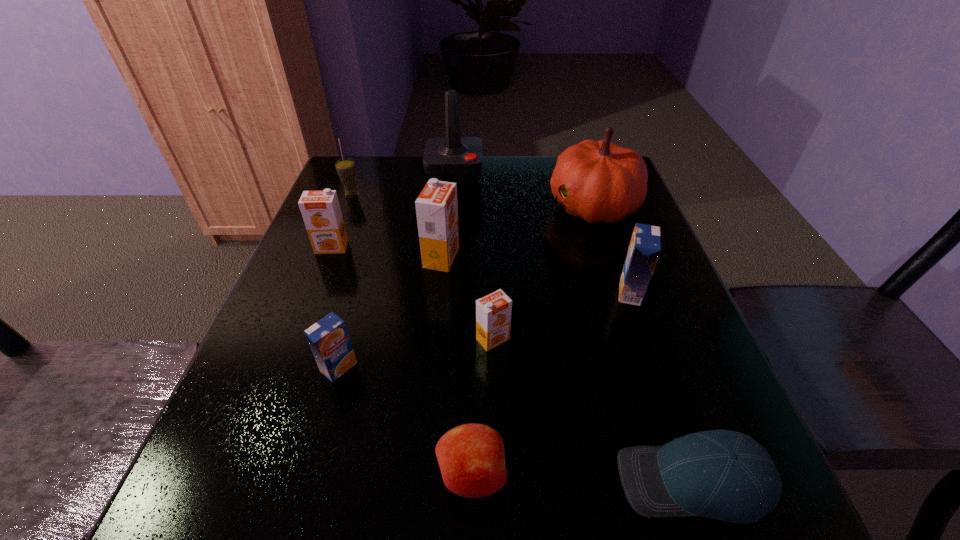
Identify the location of pumpkin located in the far edge section of the desktop. (599, 181).

Where is `straw for drinking present at the far edge`? The width and height of the screenshot is (960, 540). straw for drinking present at the far edge is located at coordinates (345, 167).

In order to click on apple located at the near edge in this screenshot , I will do `click(471, 457)`.

The width and height of the screenshot is (960, 540). Identify the location of baseball cap at the near edge. tap(725, 475).

Locate an element on the screen. The image size is (960, 540). straw for drinking present at the left edge is located at coordinates (345, 167).

You are a GUI agent. You are given a task and a screenshot of the screen. Output one action in this format:
    pyautogui.click(x=<x>, y=<y>)
    Task: Click on the pumpkin present at the right edge
    
    Given the screenshot: What is the action you would take?
    pyautogui.click(x=599, y=181)

You are a GUI agent. You are given a task and a screenshot of the screen. Output one action in this format:
    pyautogui.click(x=<x>, y=<y>)
    Task: Click on the orange_juice situated at the right edge
    
    Given the screenshot: What is the action you would take?
    pyautogui.click(x=645, y=246)

At what (x,y) coordinates should I click in order to perform the action: click on baseball cap that is positioned at the right edge. Please return your answer as a coordinate pair (x, y). Looking at the image, I should click on (725, 475).

Identify the location of object positioned at the far left corner. (345, 167).

In order to click on object that is at the far right corner in this screenshot , I will do `click(599, 181)`.